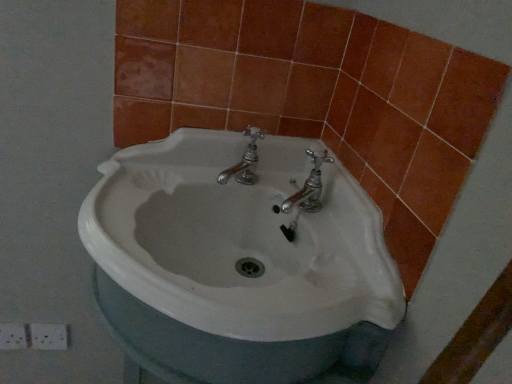
Question: Is orange matte tile at upper right, which is the second ceramic tile in right-to-left order, next to white ceramic sink at center?

Choices:
 (A) yes
 (B) no

Answer: (B)

Question: Does orange matte tile at upper right, positioned as the first ceramic tile in left-to-right order, have a lesser height compared to white ceramic sink at center?

Choices:
 (A) no
 (B) yes

Answer: (B)

Question: From the image's perspective, is orange matte tile at upper right, positioned as the first ceramic tile in left-to-right order, located beneath white ceramic sink at center?

Choices:
 (A) no
 (B) yes

Answer: (A)

Question: Is orange matte tile at upper right, which is the second ceramic tile in right-to-left order, positioned with its back to white ceramic sink at center?

Choices:
 (A) yes
 (B) no

Answer: (B)

Question: Would you say white ceramic sink at center is part of orange matte tile at upper right, positioned as the first ceramic tile in left-to-right order,'s contents?

Choices:
 (A) yes
 (B) no

Answer: (B)

Question: Is orange matte tile at upper right, positioned as the first ceramic tile in left-to-right order, thinner than white ceramic sink at center?

Choices:
 (A) yes
 (B) no

Answer: (A)

Question: From the image's perspective, is white ceramic sink at center under orange ceramic tile at lower left, which ranks as the first ceramic tile in right-to-left order?

Choices:
 (A) no
 (B) yes

Answer: (B)

Question: Is white ceramic sink at center oriented away from orange ceramic tile at lower left, acting as the second ceramic tile starting from the left?

Choices:
 (A) no
 (B) yes

Answer: (A)

Question: Considering the relative sizes of white ceramic sink at center and orange ceramic tile at lower left, which ranks as the first ceramic tile in right-to-left order, in the image provided, is white ceramic sink at center thinner than orange ceramic tile at lower left, which ranks as the first ceramic tile in right-to-left order,?

Choices:
 (A) no
 (B) yes

Answer: (A)

Question: Is white ceramic sink at center at the right side of orange ceramic tile at lower left, which ranks as the first ceramic tile in right-to-left order?

Choices:
 (A) no
 (B) yes

Answer: (B)

Question: Can you confirm if white ceramic sink at center is shorter than orange ceramic tile at lower left, which ranks as the first ceramic tile in right-to-left order?

Choices:
 (A) yes
 (B) no

Answer: (B)

Question: Is white ceramic sink at center smaller than orange ceramic tile at lower left, acting as the second ceramic tile starting from the left?

Choices:
 (A) yes
 (B) no

Answer: (B)

Question: Is orange ceramic tile at lower left, acting as the second ceramic tile starting from the left, bigger than orange matte tile at upper right, which is the second ceramic tile in right-to-left order?

Choices:
 (A) yes
 (B) no

Answer: (B)